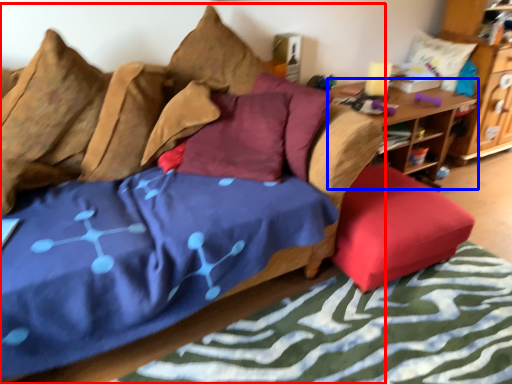
Question: Which point is further to the camera, studio couch (highlighted by a red box) or table (highlighted by a blue box)?

Choices:
 (A) studio couch
 (B) table

Answer: (B)